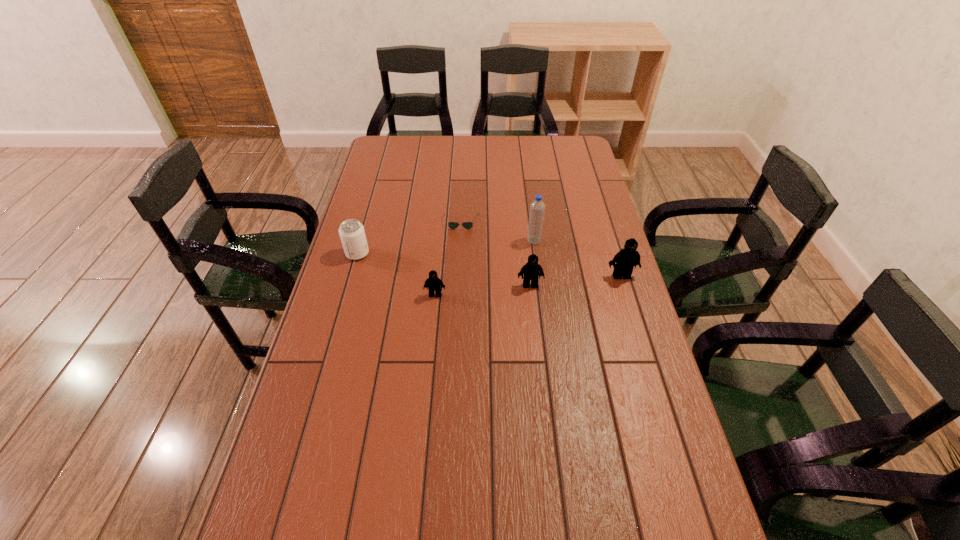
Given the evenly spaced Legos in the image, where should an extra Lego be added on the left to preserve the spacing? Please point to a vacant space. Please provide its 2D coordinates. Your answer should be formatted as a tuple, i.e. [(x, y)], where the tuple contains the x and y coordinates of a point satisfying the conditions above.

[(336, 305)]